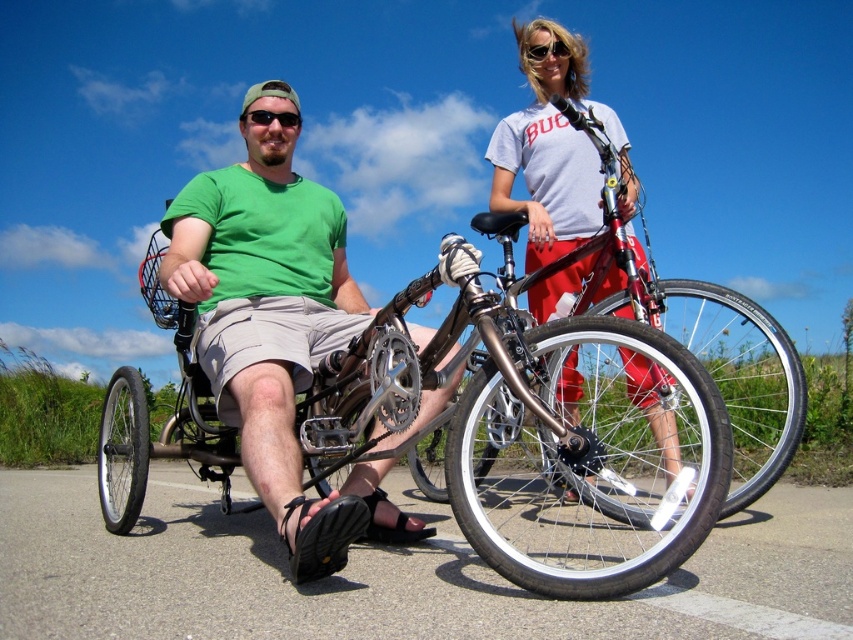
Question: Is white cotton t-shirt at upper center smaller than sunglasses at upper center?

Choices:
 (A) yes
 (B) no

Answer: (B)

Question: Estimate the real-world distances between objects in this image. Which object is farther from the sunglasses at upper center?

Choices:
 (A) green matte shirt at center
 (B) black matte sunglasses at center
 (C) white cotton t-shirt at upper center
 (D) shiny silver bicycle at center

Answer: (D)

Question: Which point is farther to the camera?

Choices:
 (A) (274, 284)
 (B) (527, 52)
 (C) (508, 122)

Answer: (C)

Question: Is black matte sunglasses at center above sunglasses at upper center?

Choices:
 (A) no
 (B) yes

Answer: (A)

Question: Is shiny silver bicycle at center wider than sunglasses at upper center?

Choices:
 (A) yes
 (B) no

Answer: (A)

Question: Which point appears farthest from the camera in this image?

Choices:
 (A) (299, 124)
 (B) (709, 282)

Answer: (B)